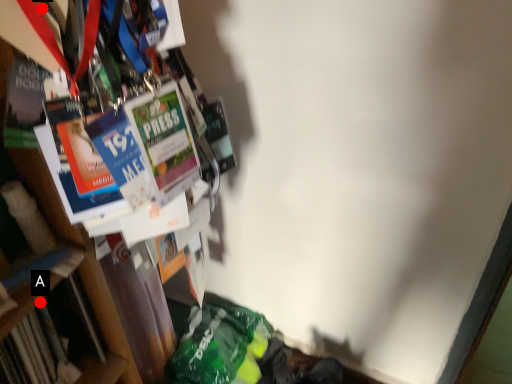
Question: Two points are circled on the image, labeled by A and B beside each circle. Which point is further to the camera?

Choices:
 (A) A is further
 (B) B is further

Answer: (A)